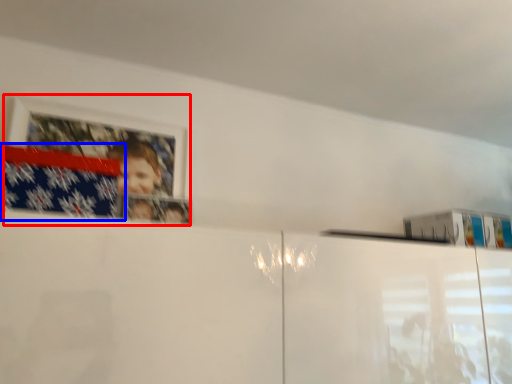
Question: Among these objects, which one is nearest to the camera, picture frame (highlighted by a red box) or flag (highlighted by a blue box)?

Choices:
 (A) picture frame
 (B) flag

Answer: (B)